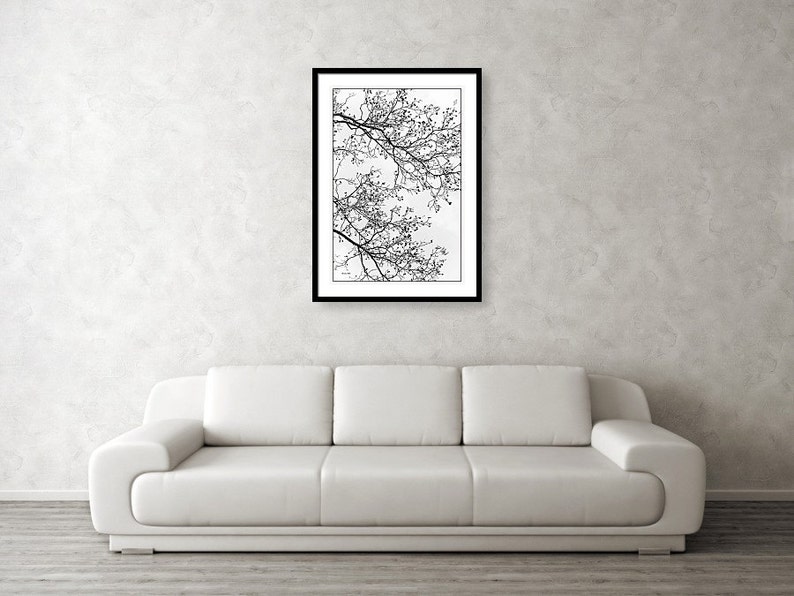
The image size is (794, 596). I want to click on wall, so click(x=723, y=34), click(x=729, y=272), click(x=738, y=400), click(x=619, y=273), click(x=237, y=240), click(x=71, y=213).